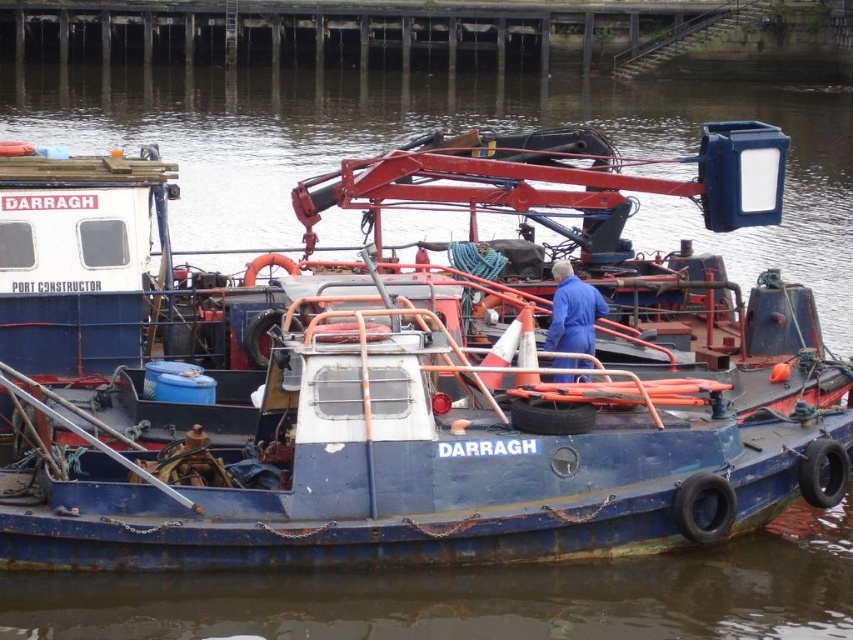
Consider the image. You are a dock worker who needs to determine if the blue smooth coveralls at center can be stored under the blue matte boat at center without folding. Based on their sizes, is this possible?

The blue matte boat at center is much taller than the blue smooth coveralls at center, so yes, the blue smooth coveralls at center can be stored under the blue matte boat at center without folding.

Based on the photo, you are an inspector on the tugboat DARRAGH. You notice the blue matte boat at center and the blue smooth coveralls at center. Which object is positioned higher from the ground?

The blue matte boat at center is above the blue smooth coveralls at center, so the blue matte boat at center is positioned higher from the ground.

You are standing on the deck of the tugboat DARRAGH and want to reach a point that is closer to you. Which point should you go to, point at coordinate (601, 522) or point at coordinate (569, 332)?

Point at coordinate (601, 522) is closer to the viewer than point at coordinate (569, 332), so you should go to point at coordinate (601, 522).